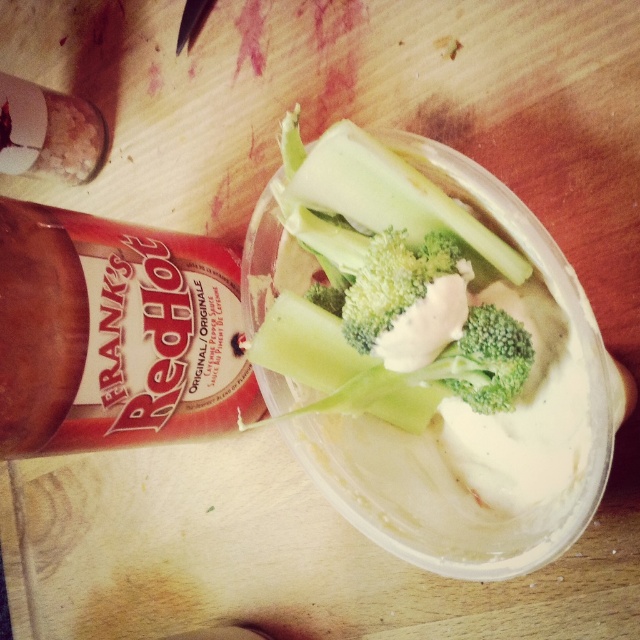
You are a person with a 12 inch long arm. You want to reach for the red matte bottle at upper left from your current position. Can you reach it?

The red matte bottle at upper left is 18.63 inches away from the viewer. Since your arm is only 12 inches long, you cannot reach it.

You are a food stylist arranging items on a table. You have a red matte bottle at upper left and green broccoli at center. From the viewer perspective, which item is closer to you?

The red matte bottle at upper left is closer to the viewer because the green broccoli at center is behind it.